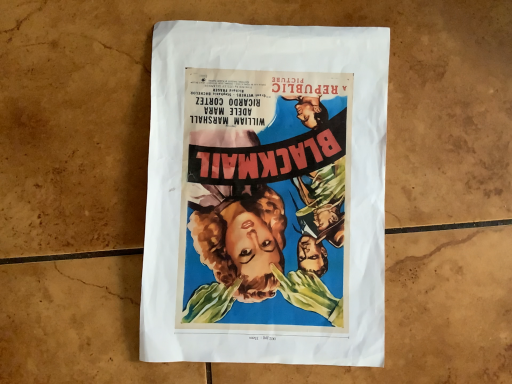
What do you see at coordinates (265, 195) in the screenshot?
I see `matte paper poster at center` at bounding box center [265, 195].

Locate an element on the screen. matte paper poster at center is located at coordinates (265, 195).

From the picture: In order to face matte paper poster at center, should I rotate leftwards or rightwards?

To align with it, rotate right about 1.392°.

Where is `matte paper poster at center`? The height and width of the screenshot is (384, 512). matte paper poster at center is located at coordinates (265, 195).